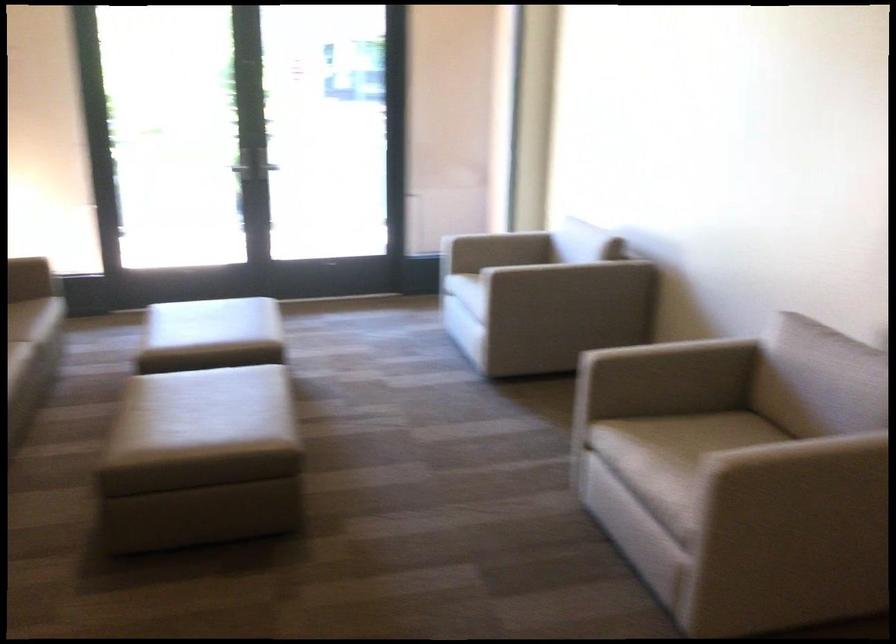
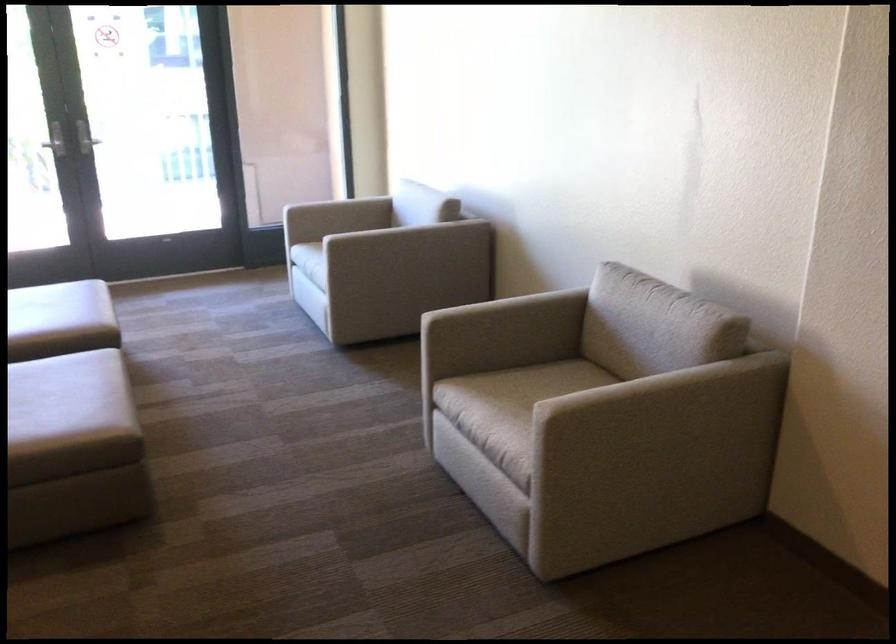
In the second image, find the point that corresponds to point (234, 319) in the first image.

(58, 308)